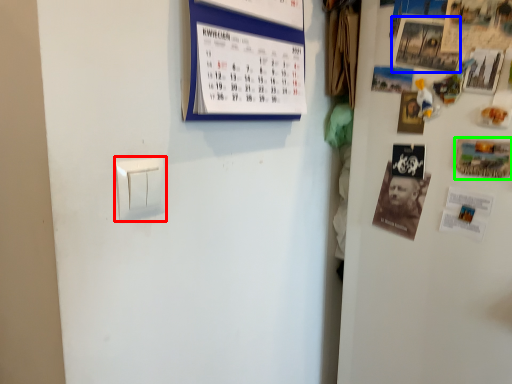
Question: Which object is the farthest from light switch (highlighted by a red box)? Choose among these: poster (highlighted by a blue box) or postcard (highlighted by a green box).

Choices:
 (A) poster
 (B) postcard

Answer: (B)